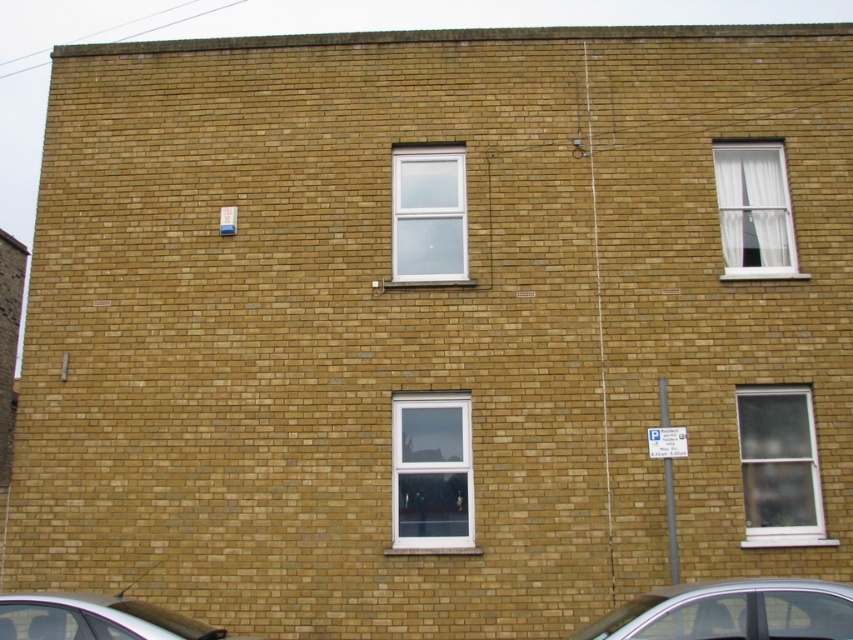
Question: Considering the real-world distances, which object is closest to the shiny metallic car at lower left?

Choices:
 (A) white plastic window at center
 (B) clear glass window at upper center

Answer: (A)

Question: Where is clear glass window at upper center located in relation to white matte window at upper right in the image?

Choices:
 (A) above
 (B) below

Answer: (B)

Question: Can you confirm if white plastic window at center is positioned to the left of clear glass window at upper center?

Choices:
 (A) no
 (B) yes

Answer: (A)

Question: Can you confirm if clear glass window at right is positioned to the left of shiny metallic car at lower left?

Choices:
 (A) yes
 (B) no

Answer: (B)

Question: Which object is positioned closest to the silver metallic car at lower right?

Choices:
 (A) clear glass window at right
 (B) shiny metallic car at lower left
 (C) clear glass window at upper center

Answer: (A)

Question: Which point is closer to the camera?

Choices:
 (A) clear glass window at right
 (B) white plastic window at center

Answer: (B)